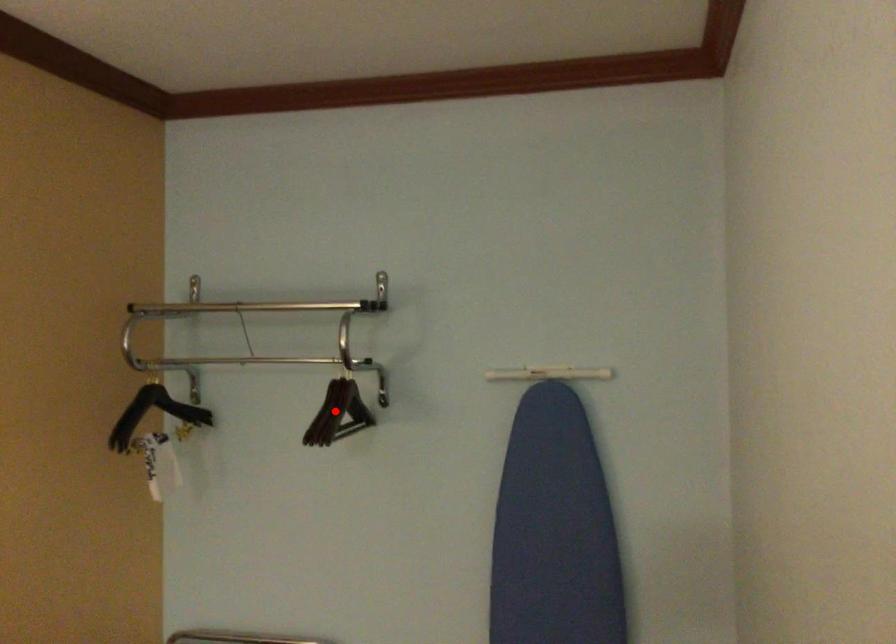
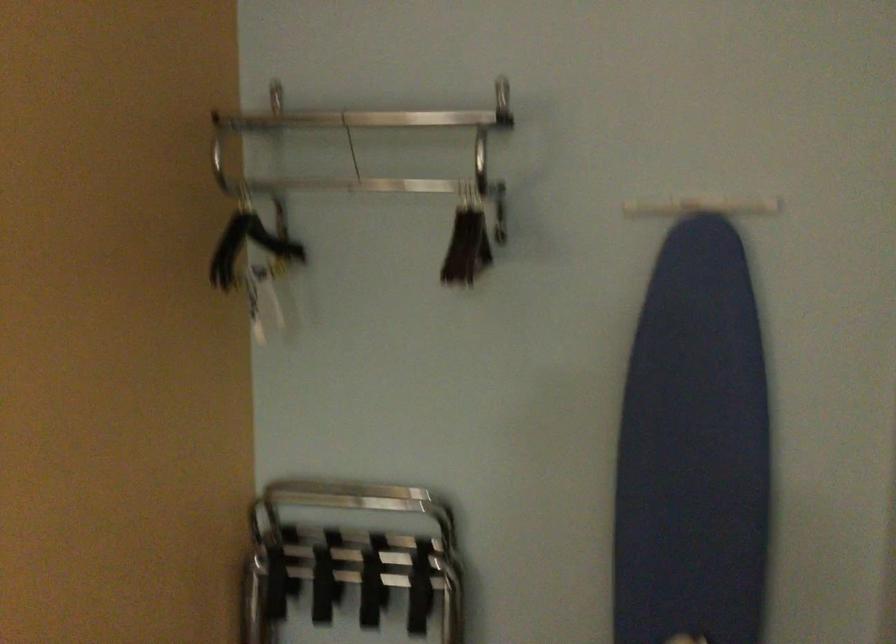
Question: I am providing you with two images of the same scene from different viewpoints. A red point is shown in image1. For the corresponding object point in image2, is it positioned nearer or farther from the camera?

Choices:
 (A) Nearer
 (B) Farther

Answer: (A)